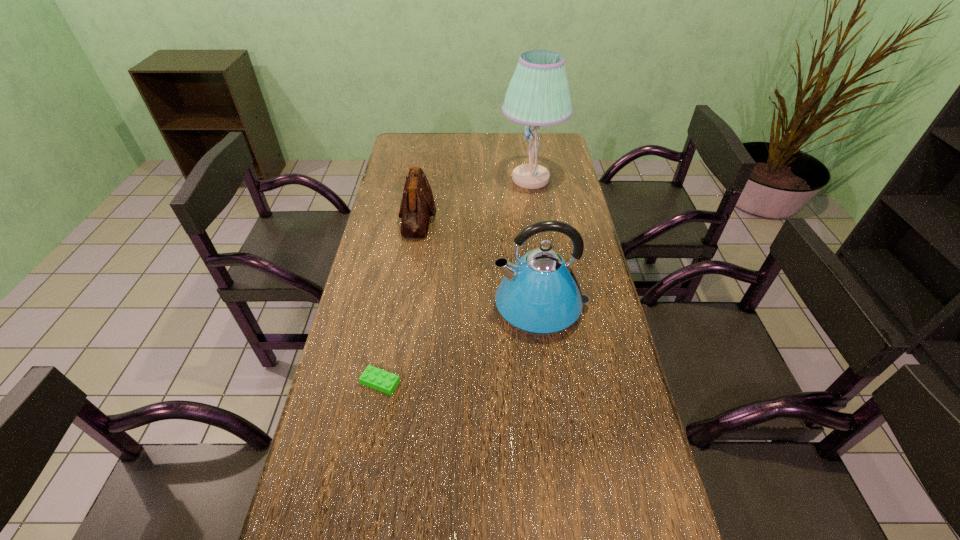
Image resolution: width=960 pixels, height=540 pixels. Find the location of `empty space between the lamp and the nearest object`. empty space between the lamp and the nearest object is located at coordinates (456, 281).

Locate an element on the screen. free space between the second nearest object and the nearest object is located at coordinates (461, 345).

Locate an element on the screen. Image resolution: width=960 pixels, height=540 pixels. free point between the second shortest object and the nearest object is located at coordinates (399, 300).

I want to click on vacant area that lies between the Lego and the shoulder bag, so click(399, 300).

Point out which object is positioned as the third nearest to the third farthest object. Please provide its 2D coordinates. Your answer should be formatted as a tuple, i.e. [(x, y)], where the tuple contains the x and y coordinates of a point satisfying the conditions above.

[(538, 94)]

This screenshot has width=960, height=540. Identify the location of object that is the second closest to the second nearest object. (417, 205).

Identify the location of free location that satisfies the following two spatial constraints: 1. on the front side of the lamp; 2. at the spout of the kettle. (550, 307).